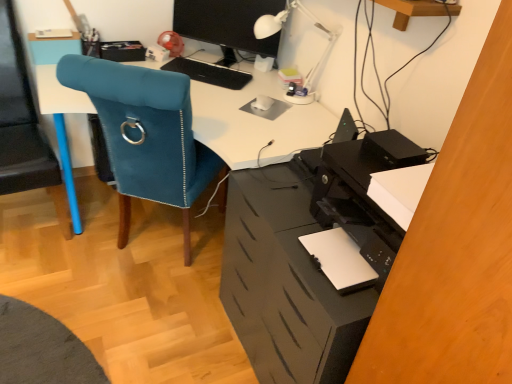
Find the location of a particular element. vacant region in front of white plastic table lamp at upper center is located at coordinates (293, 117).